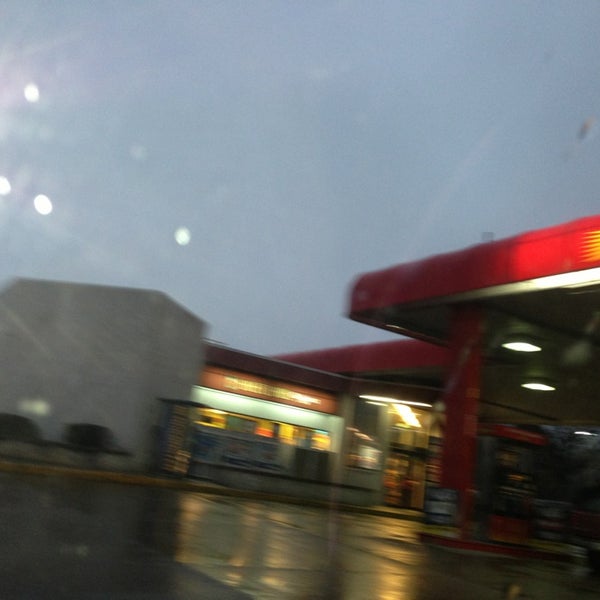
Where is `door`? The image size is (600, 600). door is located at coordinates (417, 486).